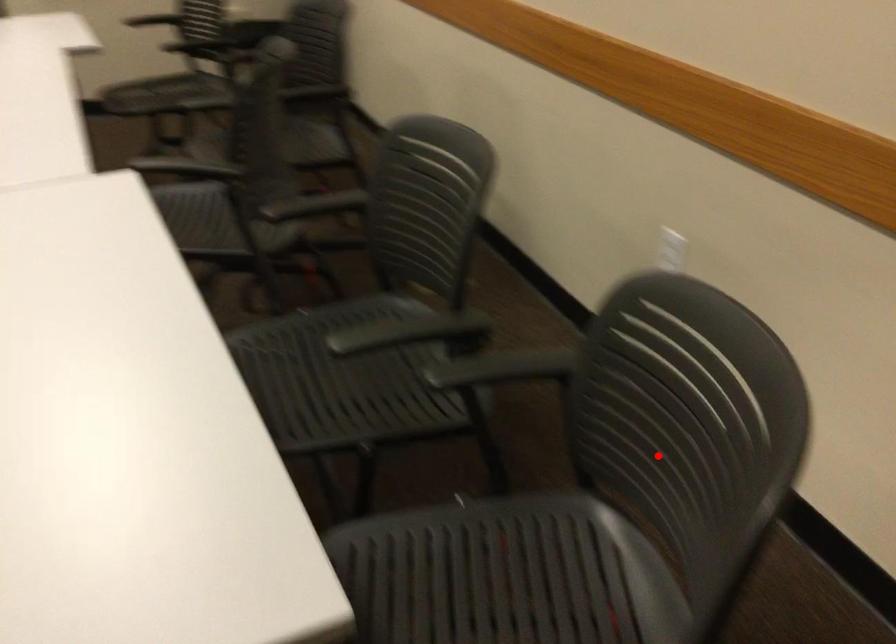
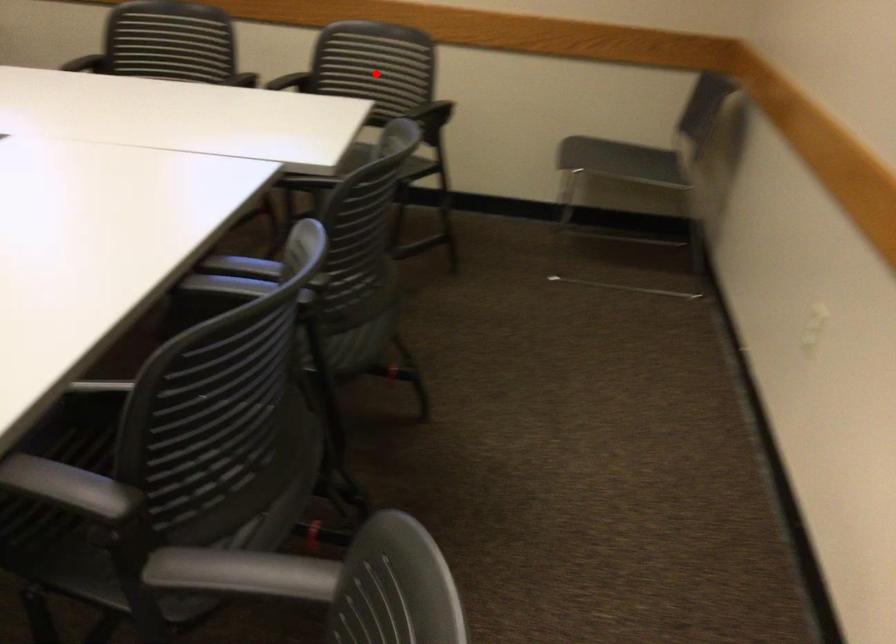
I am providing you with two images of the same scene from different viewpoints. A red point is marked on the first image and another point is marked on the second image. Do the highlighted points in image1 and image2 indicate the same real-world spot?

Yes